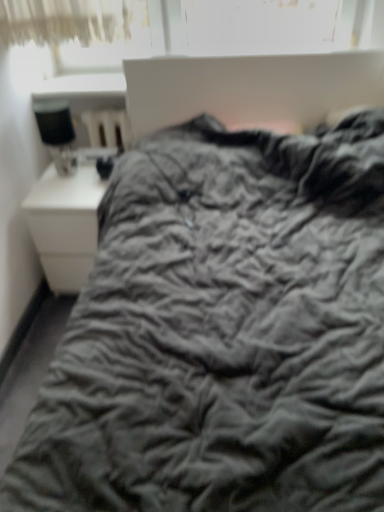
Image resolution: width=384 pixels, height=512 pixels. In order to click on white glossy nightstand at left in this screenshot , I will do `click(65, 225)`.

The width and height of the screenshot is (384, 512). Describe the element at coordinates (65, 225) in the screenshot. I see `white glossy nightstand at left` at that location.

Measure the distance between matte black lamp at left and camera.

A distance of 1.86 meters exists between matte black lamp at left and camera.

Find the location of a particular element. The height and width of the screenshot is (512, 384). matte black lamp at left is located at coordinates (57, 133).

Image resolution: width=384 pixels, height=512 pixels. Describe the element at coordinates (57, 133) in the screenshot. I see `matte black lamp at left` at that location.

This screenshot has height=512, width=384. Identify the location of white glossy nightstand at left. (65, 225).

Considering the relative positions of white glossy nightstand at left and matte black lamp at left in the image provided, is white glossy nightstand at left to the right of matte black lamp at left from the viewer's perspective?

Yes, white glossy nightstand at left is to the right of matte black lamp at left.

Looking at this image, does white glossy nightstand at left lie in front of matte black lamp at left?

That is False.

Which point is more forward, (48, 232) or (41, 130)?

Point (41, 130)

From the image's perspective, is white glossy nightstand at left below matte black lamp at left?

Indeed, from the image's perspective, white glossy nightstand at left is shown beneath matte black lamp at left.

Based on the photo, from a real-world perspective, is white glossy nightstand at left positioned under matte black lamp at left based on gravity?

Yes.

Can you confirm if white glossy nightstand at left is wider than matte black lamp at left?

Indeed, white glossy nightstand at left has a greater width compared to matte black lamp at left.

Considering the relative sizes of white glossy nightstand at left and matte black lamp at left in the image provided, is white glossy nightstand at left shorter than matte black lamp at left?

No.

Based on the photo, considering the relative sizes of white glossy nightstand at left and matte black lamp at left in the image provided, is white glossy nightstand at left smaller than matte black lamp at left?

Incorrect, white glossy nightstand at left is not smaller in size than matte black lamp at left.

Does white glossy nightstand at left contain matte black lamp at left?

No, matte black lamp at left is located outside of white glossy nightstand at left.

Does white glossy nightstand at left touch matte black lamp at left?

No, white glossy nightstand at left is not next to matte black lamp at left.

From the picture: Is matte black lamp at left at the back of white glossy nightstand at left?

white glossy nightstand at left is not turned away from matte black lamp at left.

What are the coordinates of `nightstand located on the right of matte black lamp at left` in the screenshot? It's located at (65, 225).

Based on the photo, is matte black lamp at left to the right of white glossy nightstand at left from the viewer's perspective?

No.

Which object is closer to the camera, matte black lamp at left or white glossy nightstand at left?

matte black lamp at left.

Considering the positions of point (45, 118) and point (85, 178), is point (45, 118) closer or farther from the camera than point (85, 178)?

Point (45, 118).

From the image's perspective, is matte black lamp at left on top of white glossy nightstand at left?

Yes, from the image's perspective, matte black lamp at left is above white glossy nightstand at left.

From a real-world perspective, relative to white glossy nightstand at left, is matte black lamp at left vertically above or below?

From a real-world perspective, matte black lamp at left is physically above white glossy nightstand at left.

Does matte black lamp at left have a lesser width compared to white glossy nightstand at left?

Indeed, matte black lamp at left has a lesser width compared to white glossy nightstand at left.

Considering the relative sizes of matte black lamp at left and white glossy nightstand at left in the image provided, is matte black lamp at left shorter than white glossy nightstand at left?

Indeed, matte black lamp at left has a lesser height compared to white glossy nightstand at left.

Considering the sizes of objects matte black lamp at left and white glossy nightstand at left in the image provided, who is bigger, matte black lamp at left or white glossy nightstand at left?

white glossy nightstand at left is bigger.

Is white glossy nightstand at left inside matte black lamp at left?

No, matte black lamp at left does not contain white glossy nightstand at left.

Is matte black lamp at left far from white glossy nightstand at left?

No, matte black lamp at left is in close proximity to white glossy nightstand at left.

Consider the image. Could you tell me if matte black lamp at left is turned towards white glossy nightstand at left?

No, matte black lamp at left is not aimed at white glossy nightstand at left.

What's the angular difference between matte black lamp at left and white glossy nightstand at left's facing directions?

matte black lamp at left and white glossy nightstand at left are facing 0.842 degrees away from each other.

Locate an element on the screen. The image size is (384, 512). nightstand below the matte black lamp at left (from the image's perspective) is located at coordinates (65, 225).

Find the location of a particular element. The width and height of the screenshot is (384, 512). table lamp that appears above the white glossy nightstand at left (from a real-world perspective) is located at coordinates (57, 133).

The image size is (384, 512). What are the coordinates of `nightstand that is below the matte black lamp at left (from the image's perspective)` in the screenshot? It's located at (65, 225).